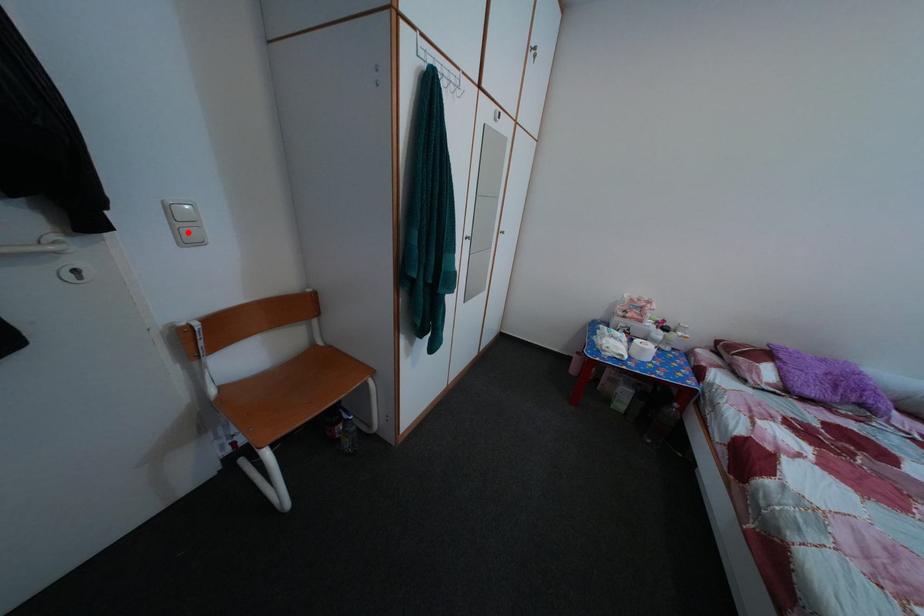
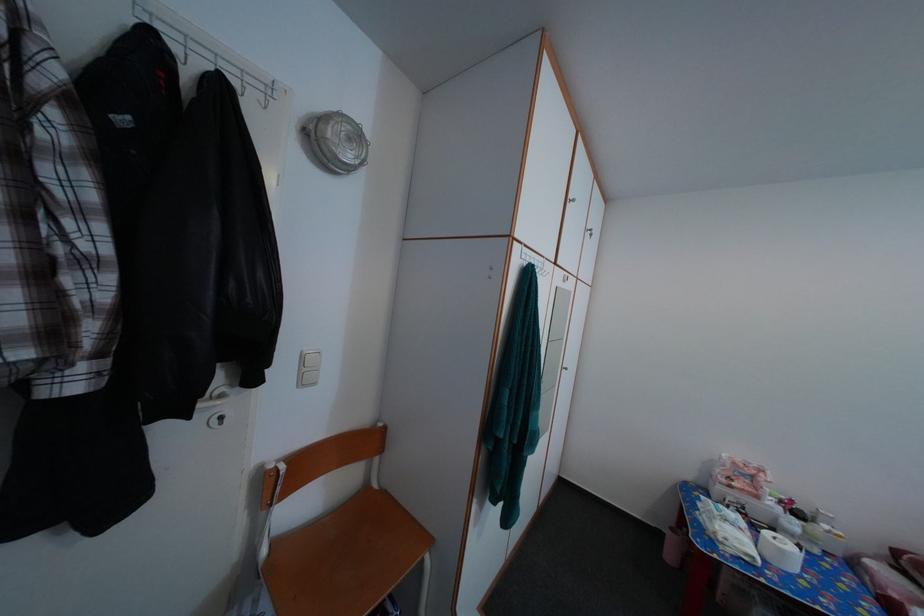
Find the pixel in the second image that matches the highlighted location in the first image.

(313, 378)